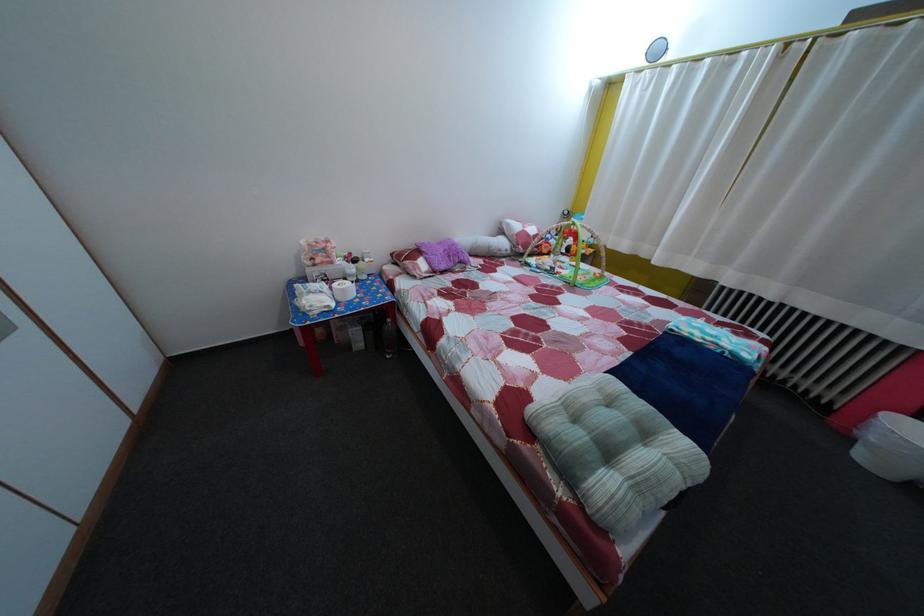
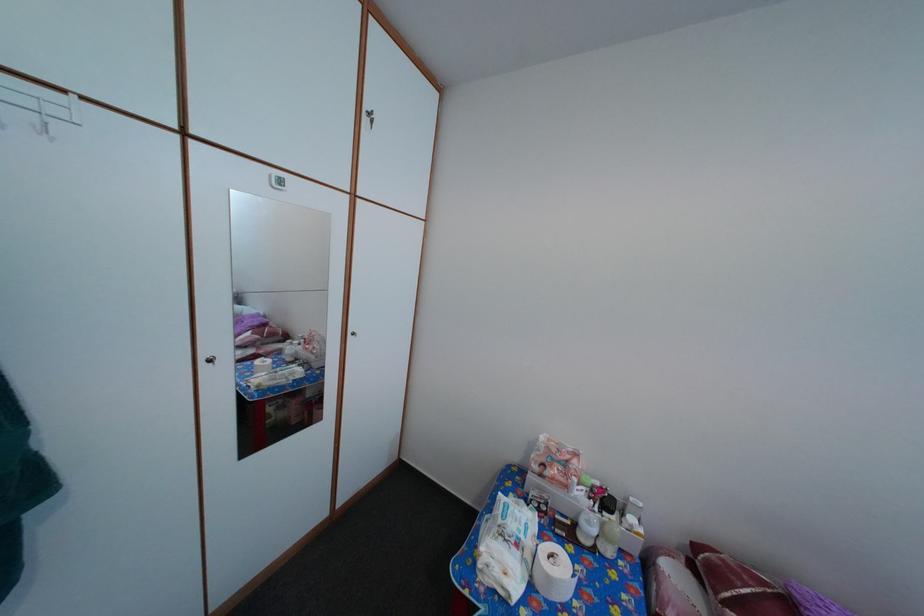
Locate, in the second image, the point that corresponds to pixel 402 262 in the first image.

(704, 554)